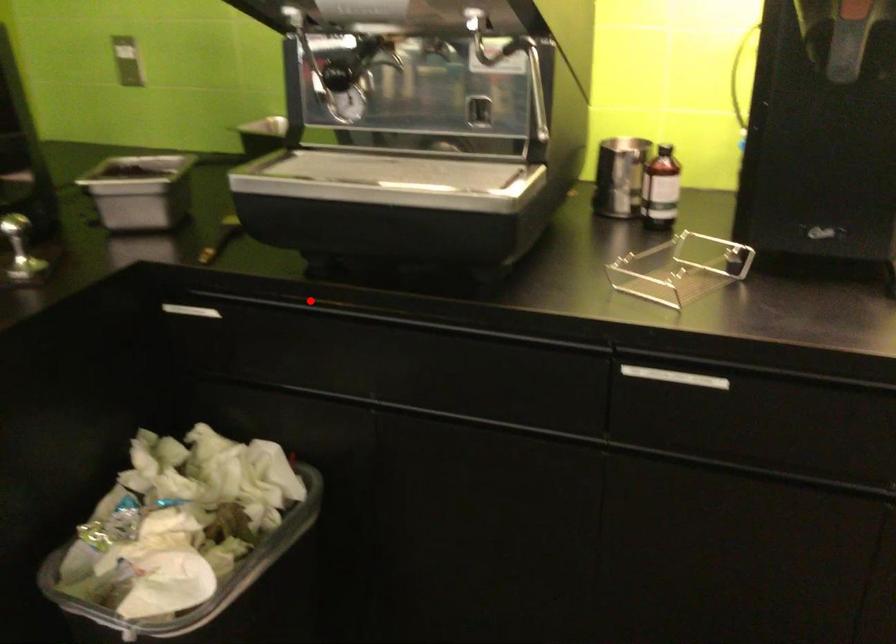
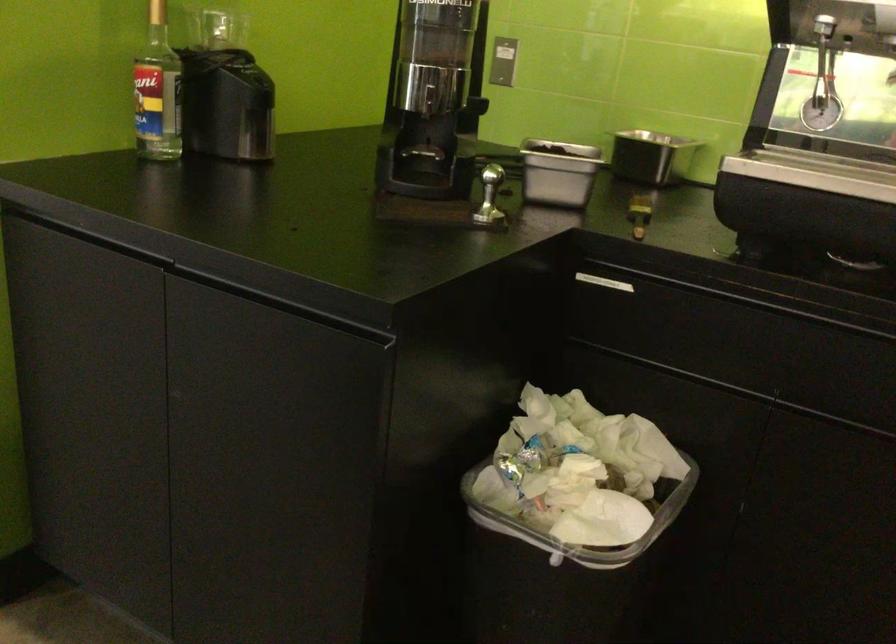
The point at the highlighted location is marked in the first image. Where is the corresponding point in the second image?

(744, 287)